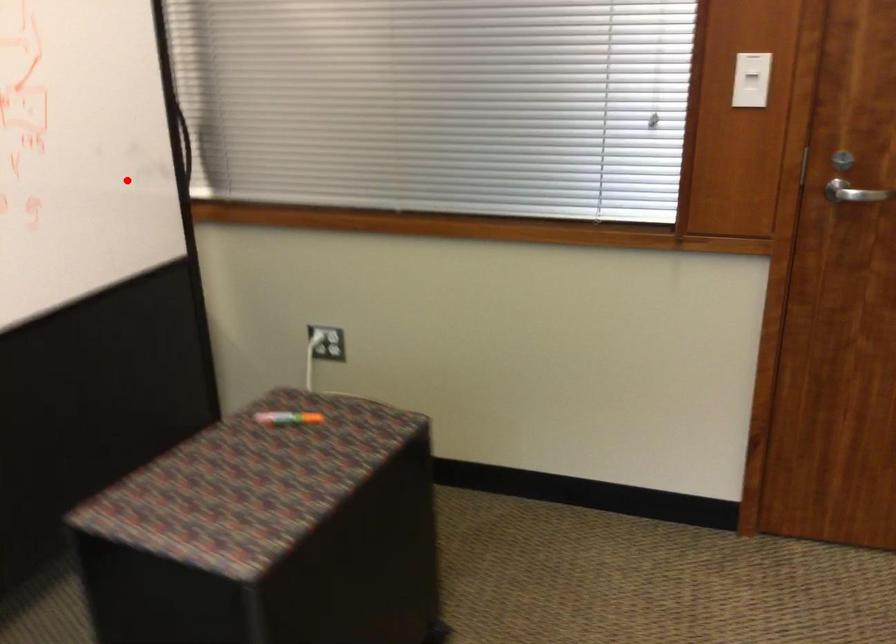
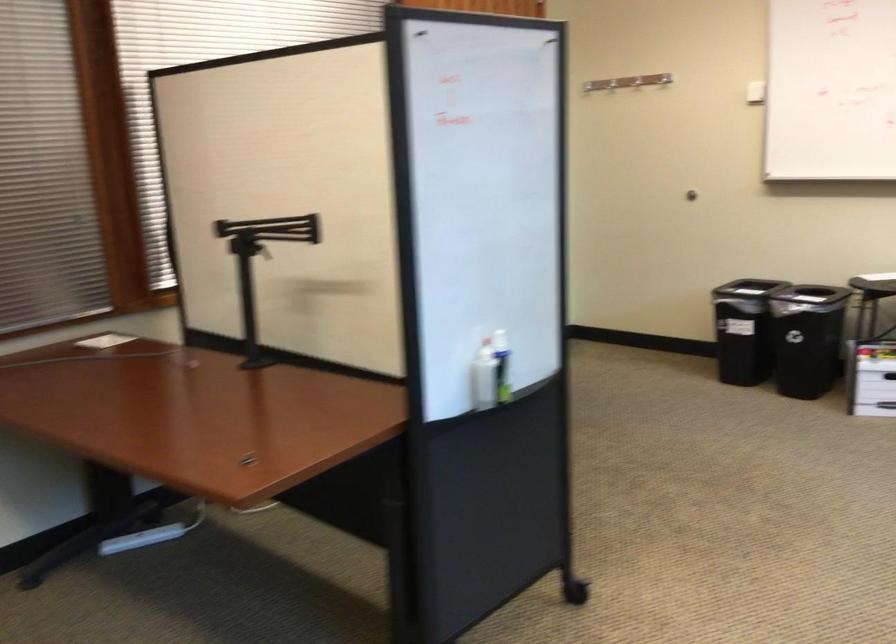
Question: I am providing you with two images of the same scene from different viewpoints. Image1 has a red point marked. In image2, the corresponding 3D location appears at what relative position? Reply with the corresponding letter.

Choices:
 (A) Closer
 (B) Farther

Answer: (B)